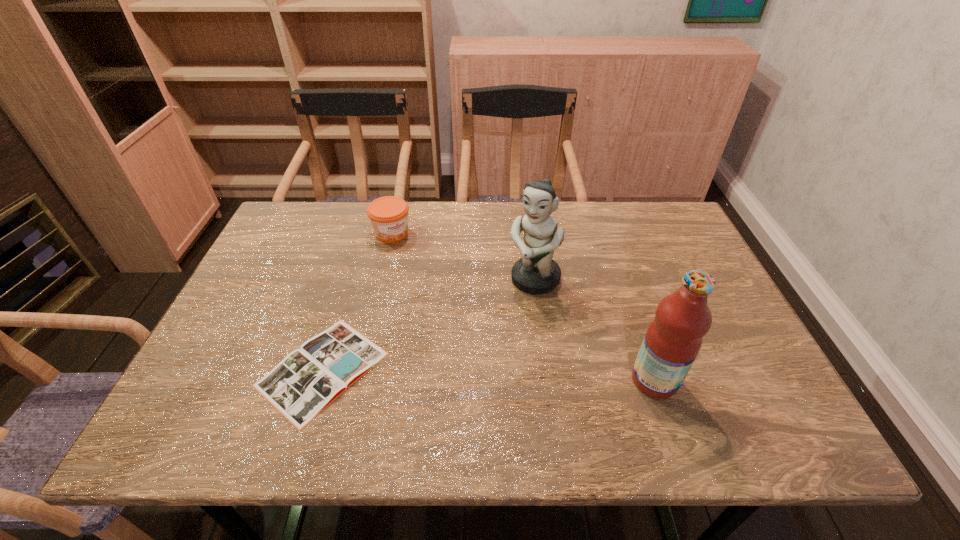
Identify the location of the shortest object. Image resolution: width=960 pixels, height=540 pixels. click(306, 381).

At what (x,y) coordinates should I click in order to perform the action: click on fruit juice. Please return your answer as a coordinate pair (x, y). Looking at the image, I should click on [673, 339].

At what (x,y) coordinates should I click in order to perform the action: click on the second farthest object. Please return your answer as a coordinate pair (x, y). This screenshot has height=540, width=960. Looking at the image, I should click on (536, 272).

This screenshot has height=540, width=960. What are the coordinates of `the second object from right to left` in the screenshot? It's located at (536, 272).

Where is `the third tallest object`? the third tallest object is located at coordinates 389,215.

Find the location of a particular element. The width and height of the screenshot is (960, 540). the farthest object is located at coordinates (389, 215).

You are a GUI agent. You are given a task and a screenshot of the screen. Output one action in this format:
    pyautogui.click(x=<x>, y=<y>)
    Task: Click on the free space located 0.300m on the back of the book
    The width and height of the screenshot is (960, 540).
    Given the screenshot: What is the action you would take?
    pyautogui.click(x=362, y=244)

Find the location of `vacant space located 0.170m on the front label of the fruit juice`. vacant space located 0.170m on the front label of the fruit juice is located at coordinates (756, 380).

Where is `vacant position located on the front-facing side of the figurine`? vacant position located on the front-facing side of the figurine is located at coordinates (503, 321).

Image resolution: width=960 pixels, height=540 pixels. Identify the location of free space located on the front-facing side of the figurine. (511, 310).